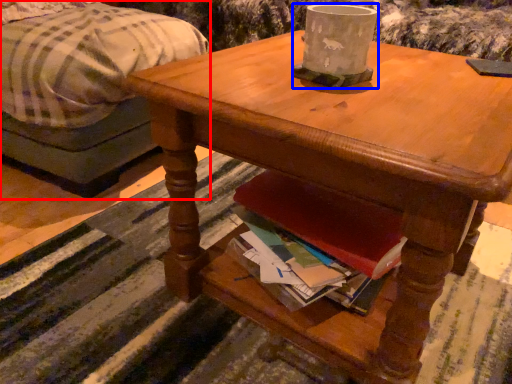
Question: Which of the following is the closest to the observer, studio couch (highlighted by a red box) or coffee cup (highlighted by a blue box)?

Choices:
 (A) studio couch
 (B) coffee cup

Answer: (B)